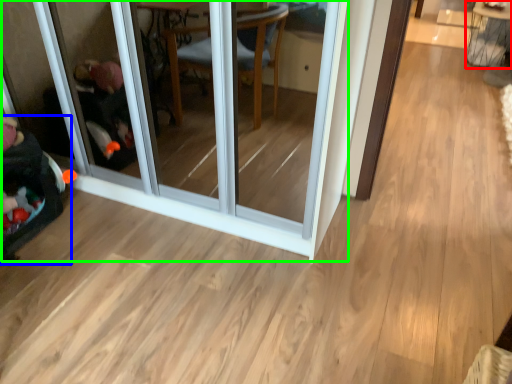
Question: Considering the real-world distances, which object is closest to table (highlighted by a red box)? baby carriage (highlighted by a blue box) or screen door (highlighted by a green box).

Choices:
 (A) baby carriage
 (B) screen door

Answer: (B)